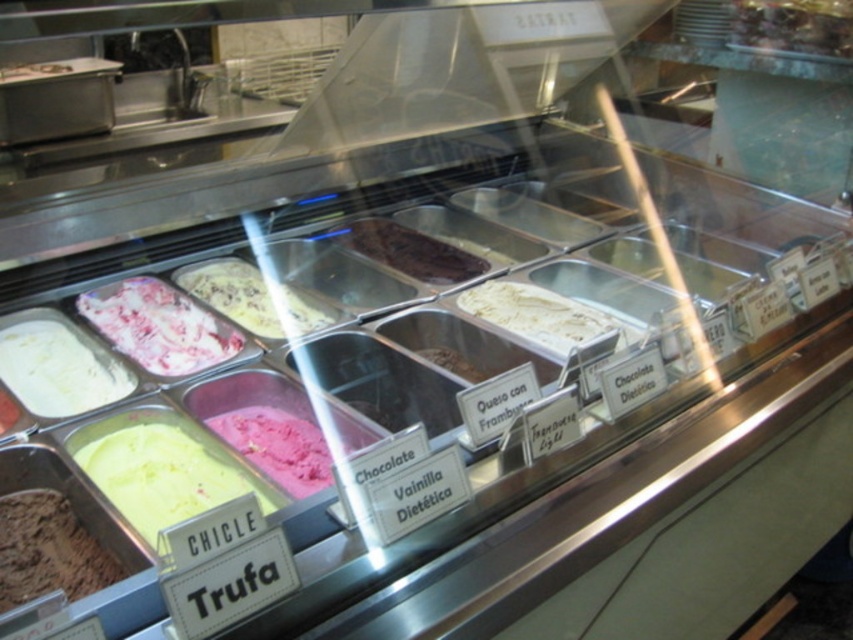
Question: Which point is farther from the camera taking this photo?

Choices:
 (A) (4, 396)
 (B) (105, 481)
 (C) (550, 340)

Answer: (C)

Question: Can you confirm if pink creamy ice cream at left is positioned to the left of pink creamy ice cream at center left?

Choices:
 (A) no
 (B) yes

Answer: (B)

Question: Among these objects, which one is nearest to the camera?

Choices:
 (A) white creamy ice cream at center
 (B) pink creamy ice cream at left

Answer: (B)

Question: Considering the relative positions of pink creamy ice cream at center left and white creamy ice cream at center in the image provided, where is pink creamy ice cream at center left located with respect to white creamy ice cream at center?

Choices:
 (A) below
 (B) above

Answer: (A)

Question: Which object is positioned farthest from the chocolate creamy ice cream at lower left?

Choices:
 (A) chocolatesmoothice cream at center
 (B) pink creamy ice cream at center
 (C) chocolate creamy ice cream at center
 (D) pink creamy ice cream at center left

Answer: (A)

Question: Is lime green creamy ice cream at center bigger than pink creamy ice cream at center?

Choices:
 (A) yes
 (B) no

Answer: (B)